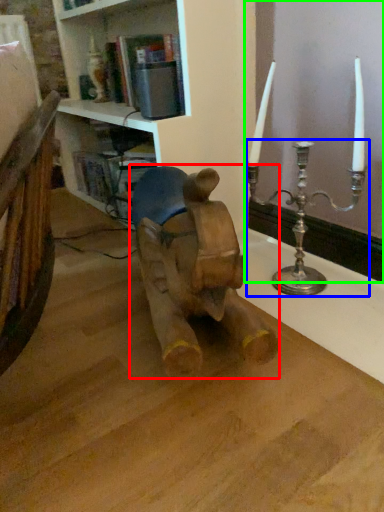
Question: Which is farther away from animal (highlighted by a red box)? candle holder (highlighted by a blue box) or window frame (highlighted by a green box)?

Choices:
 (A) candle holder
 (B) window frame

Answer: (B)